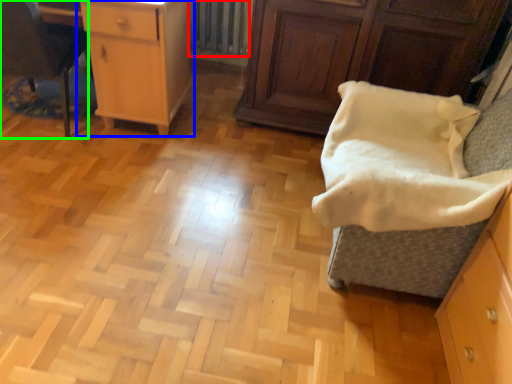
Question: Considering the real-world distances, which object is closest to radiator (highlighted by a red box)? chest of drawers (highlighted by a blue box) or furniture (highlighted by a green box).

Choices:
 (A) chest of drawers
 (B) furniture

Answer: (A)